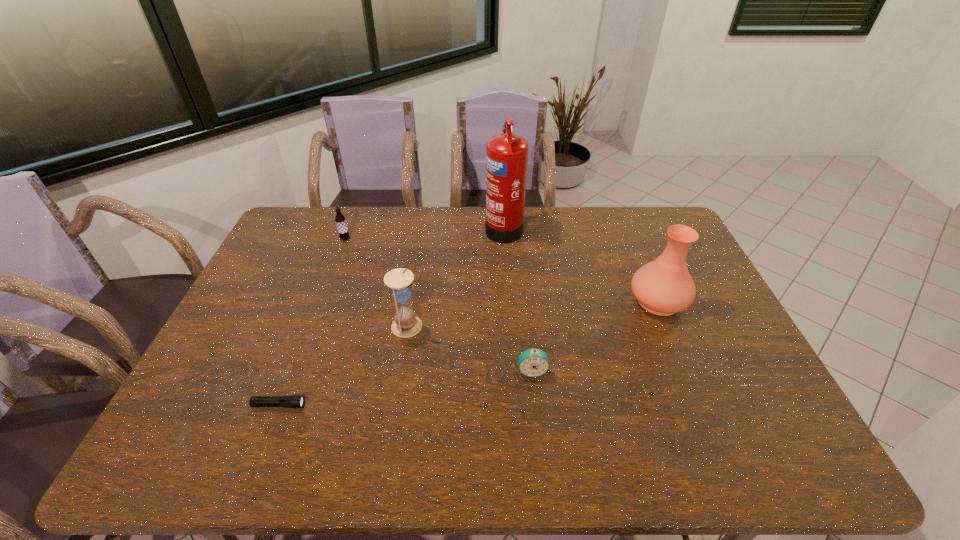
You are a GUI agent. You are given a task and a screenshot of the screen. Output one action in this format:
    pyautogui.click(x=<x>, y=<y>)
    Task: Click on the tallest object
    This screenshot has height=540, width=960.
    Given the screenshot: What is the action you would take?
    pyautogui.click(x=506, y=154)

Image resolution: width=960 pixels, height=540 pixels. I want to click on the second tallest object, so click(664, 286).

Where is `the rightmost object`? The height and width of the screenshot is (540, 960). the rightmost object is located at coordinates (664, 286).

Find the location of a particular element. Image resolution: width=960 pixels, height=540 pixels. hourglass is located at coordinates (406, 324).

Image resolution: width=960 pixels, height=540 pixels. In order to click on the fourth shortest object in this screenshot , I will do `click(406, 324)`.

Where is `root beer`? The image size is (960, 540). root beer is located at coordinates (340, 219).

I want to click on alarm clock, so click(x=533, y=362).

Where is `the second nearest object`? The height and width of the screenshot is (540, 960). the second nearest object is located at coordinates (533, 362).

I want to click on the shortest object, so click(x=293, y=401).

This screenshot has width=960, height=540. I want to click on the nearest object, so click(x=293, y=401).